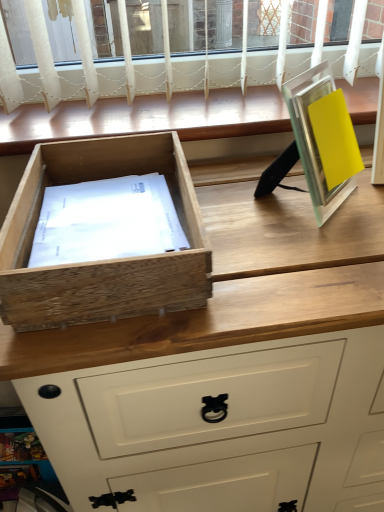
Where is `free point to the right of natural wood drawer at left`? free point to the right of natural wood drawer at left is located at coordinates tap(272, 233).